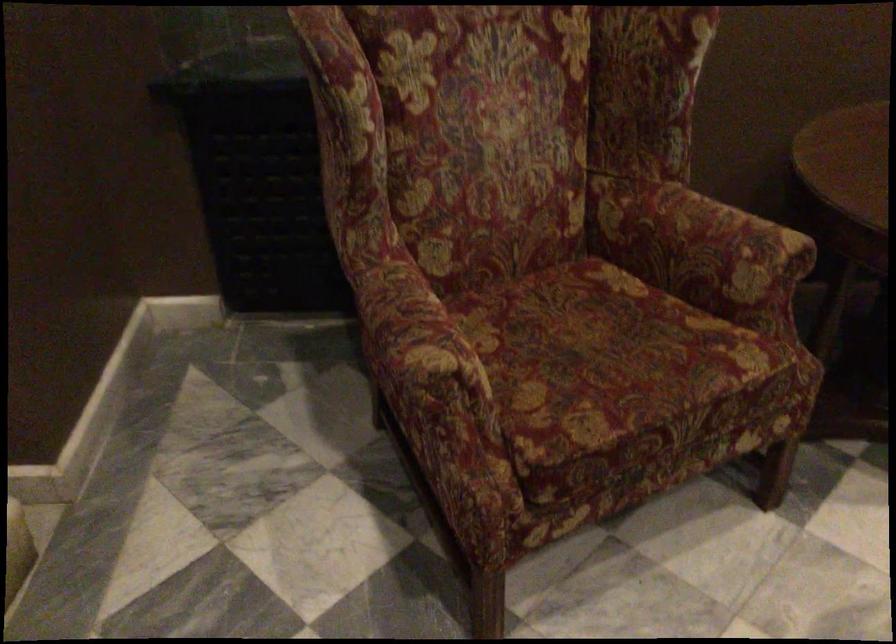
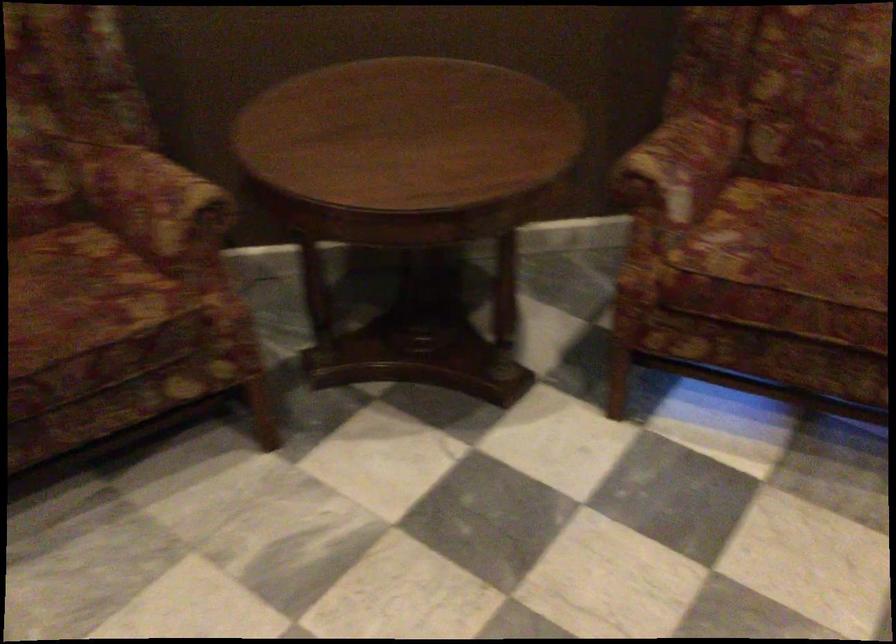
Locate, in the second image, the point that corresponds to the point at 653,336 in the first image.

(80, 292)